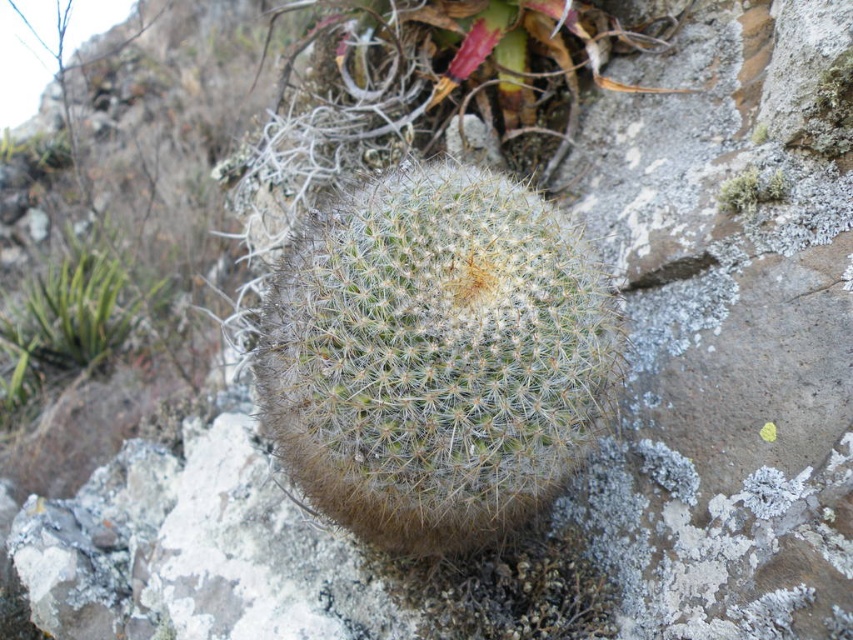
Question: Is white spiny cactus at center in front of green spiky cactus at left?

Choices:
 (A) yes
 (B) no

Answer: (A)

Question: Which of the following is the farthest from the observer?

Choices:
 (A) [334, 221]
 (B) [733, 211]

Answer: (B)

Question: Among these points, which one is farthest from the camera?

Choices:
 (A) (22, 310)
 (B) (735, 195)

Answer: (A)

Question: Does white spiny cactus at center have a larger size compared to green spiky cactus at left?

Choices:
 (A) no
 (B) yes

Answer: (A)

Question: Considering the relative positions of white spiny cactus at center and white fuzzy lichen at upper right in the image provided, where is white spiny cactus at center located with respect to white fuzzy lichen at upper right?

Choices:
 (A) left
 (B) right

Answer: (A)

Question: Estimate the real-world distances between objects in this image. Which object is closer to the white spiny cactus at center?

Choices:
 (A) green spiky cactus at left
 (B) white fuzzy lichen at upper right

Answer: (B)